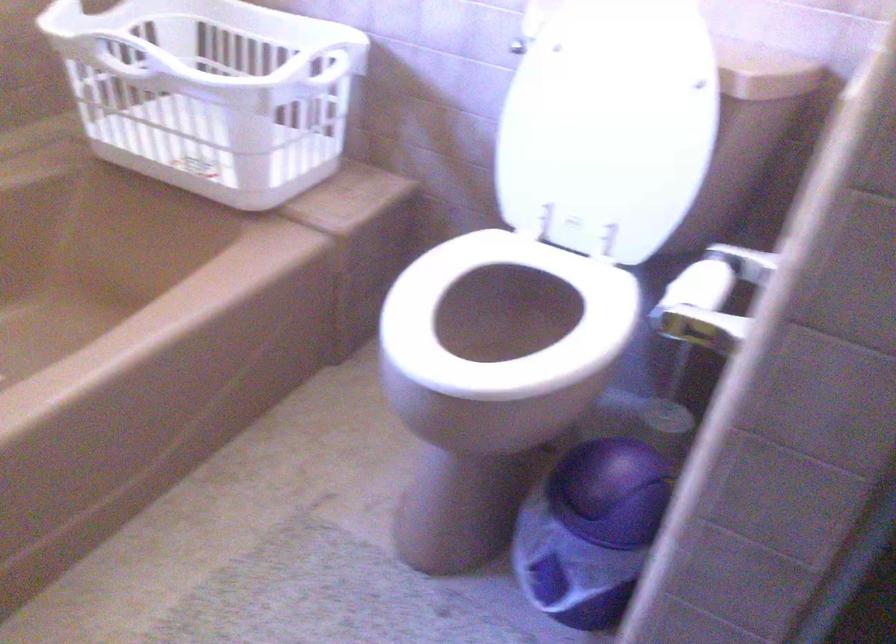
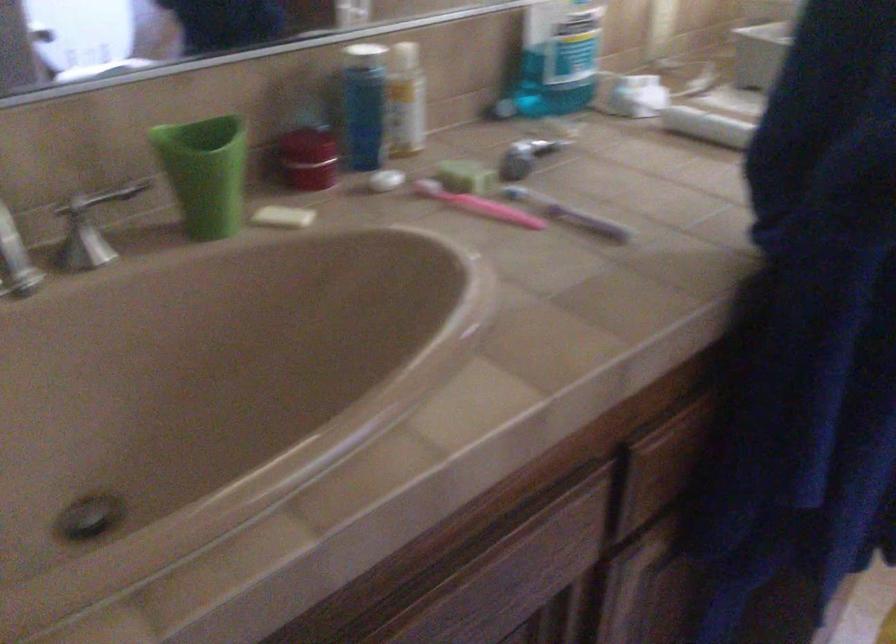
Based on the continuous images, in which direction is the camera rotating?

The rotation direction of the camera is left-down.